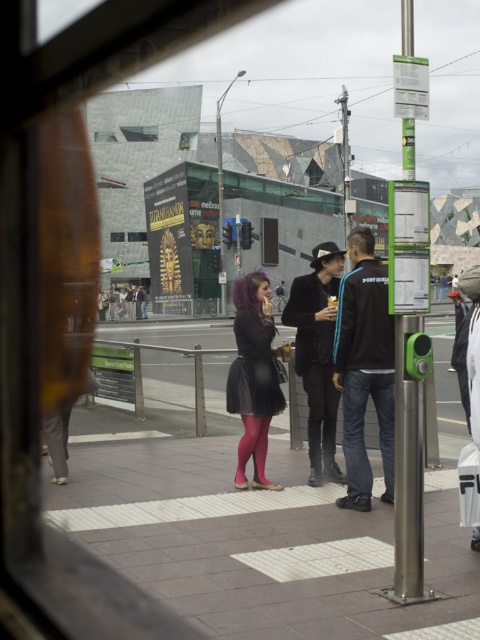
You are a photographer standing at the window of a moving tram. You want to take a photo of both the matte black jacket at center and the matte black dress at center. The minimum distance between the two subjects for your camera to focus on both clearly is 20 inches. Can you capture them both in focus?

The matte black jacket at center is 20.29 inches from the matte black dress at center, which exceeds the minimum required distance of 20 inches. Therefore, you can capture both subjects in focus.

You are a fashion designer observing a street scene through a window. You notice two items of clothing at the center of your view. Which one is smaller in size between the matte black jacket at center and the matte black dress at center?

The matte black jacket at center is smaller in size compared to the matte black dress at center.